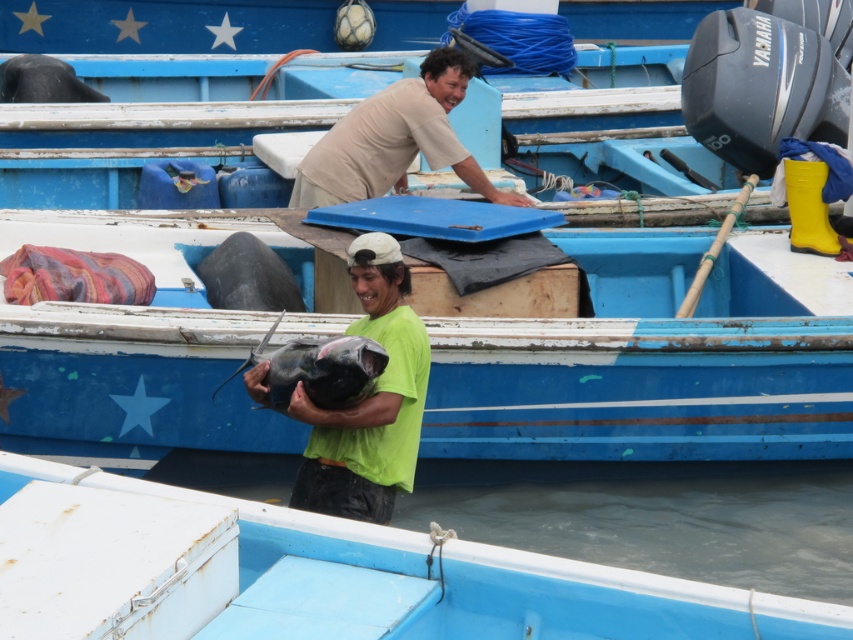
How much distance is there between green matte shirt at center and shiny dark gray fish at center?

green matte shirt at center and shiny dark gray fish at center are 8.25 inches apart.

Can you confirm if green matte shirt at center is bigger than shiny dark gray fish at center?

Yes, green matte shirt at center is bigger than shiny dark gray fish at center.

Locate an element on the screen. This screenshot has width=853, height=640. green matte shirt at center is located at coordinates (368, 400).

Locate an element on the screen. green matte shirt at center is located at coordinates pyautogui.click(x=368, y=400).

Is point (250, 387) farther from viewer compared to point (489, 184)?

No.

Locate an element on the screen. The image size is (853, 640). green matte shirt at center is located at coordinates (368, 400).

Does blue painted wood boat at center have a greater height compared to green matte shirt at center?

In fact, blue painted wood boat at center may be shorter than green matte shirt at center.

From the picture: Who is more forward, (665,298) or (254,371)?

Positioned in front is point (254,371).

Is point (111, 216) positioned behind point (410, 396)?

Yes, point (111, 216) is farther from viewer.

Where is `blue painted wood boat at center`? blue painted wood boat at center is located at coordinates (645, 365).